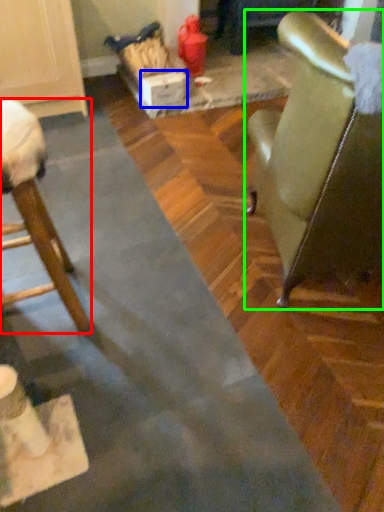
Question: Based on their relative distances, which object is farther from chair (highlighted by a red box)? Choose from cardboard box (highlighted by a blue box) and chair (highlighted by a green box).

Choices:
 (A) cardboard box
 (B) chair

Answer: (A)